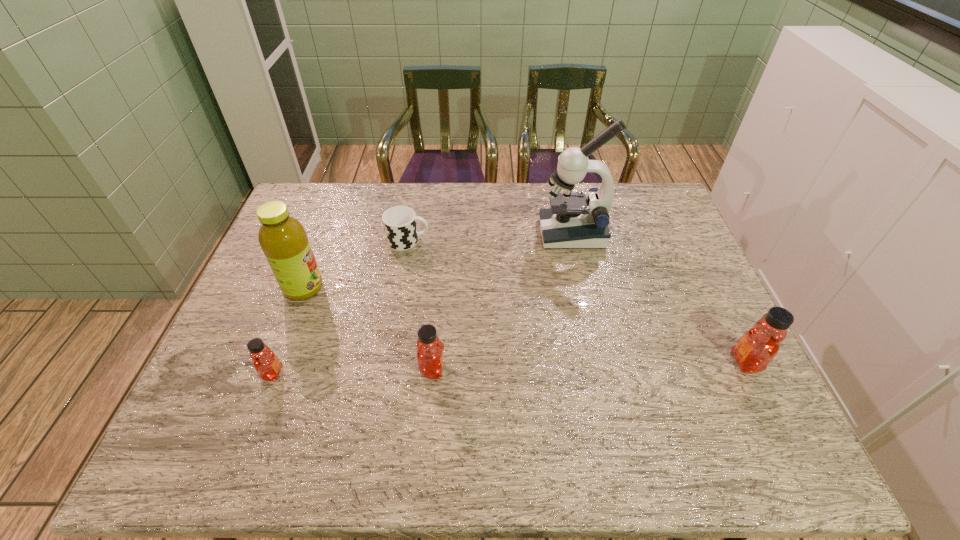
Where is `free point at the far right corner`? free point at the far right corner is located at coordinates (633, 216).

Find the location of a particular element. The width and height of the screenshot is (960, 540). free point between the fruit juice and the leftmost honey is located at coordinates (288, 330).

Identify the location of vacant point located between the cup and the fruit juice. This screenshot has height=540, width=960. (356, 265).

The height and width of the screenshot is (540, 960). Find the location of `free space between the leftmost honey and the second tallest honey`. free space between the leftmost honey and the second tallest honey is located at coordinates (353, 371).

The height and width of the screenshot is (540, 960). Find the location of `free space between the fourth tallest object and the fruit juice`. free space between the fourth tallest object and the fruit juice is located at coordinates (369, 329).

Identify the location of vacant area between the fifth shortest object and the tallest object. The width and height of the screenshot is (960, 540). (438, 261).

You are a GUI agent. You are given a task and a screenshot of the screen. Output one action in this format:
    pyautogui.click(x=<x>, y=<y>)
    Task: Click on the blank region between the tallest honey and the cup
    
    Given the screenshot: What is the action you would take?
    pyautogui.click(x=577, y=301)

Identify the location of empty location between the fifth shortest object and the shortest object. This screenshot has height=540, width=960. (356, 265).

Identify the location of vacant area that lies between the third tallest object and the microscope. (659, 298).

What are the coordinates of `vacant area that lies between the second object from right to left and the rightmost honey` in the screenshot? It's located at (659, 298).